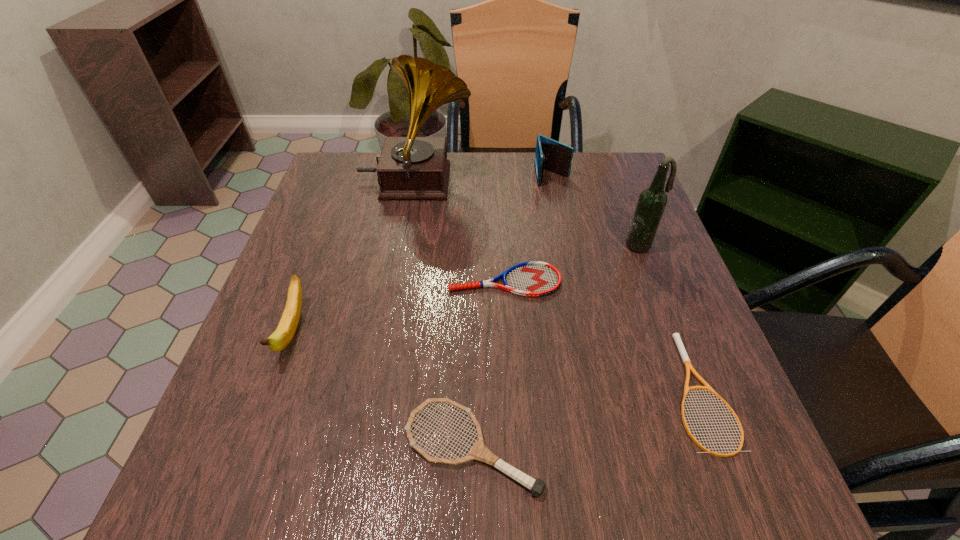
The height and width of the screenshot is (540, 960). I want to click on tennis racket that is the nearest to the sixth shortest object, so (533, 278).

You are a GUI agent. You are given a task and a screenshot of the screen. Output one action in this format:
    pyautogui.click(x=<x>, y=<y>)
    Task: Click on the free space that satisfies the following two spatial constraints: 1. from the horn of the tallest object; 2. on the right side of the farthest tennis racket
    This screenshot has height=540, width=960.
    Given the screenshot: What is the action you would take?
    pyautogui.click(x=398, y=281)

Find the location of a particular element. free space that satisfies the following two spatial constraints: 1. from the horn of the phonograph record; 2. on the back side of the beer bottle is located at coordinates (404, 246).

This screenshot has height=540, width=960. I want to click on free space that satisfies the following two spatial constraints: 1. on the exterior surface of the wallet; 2. from the horn of the phonograph record, so click(554, 183).

The height and width of the screenshot is (540, 960). What are the coordinates of `vacant area in the image that satisfies the following two spatial constraints: 1. at the stem of the third shortest object; 2. on the right side of the leftmost object` in the screenshot? It's located at 251,448.

At what (x,y) coordinates should I click in order to perform the action: click on free space that satisfies the following two spatial constraints: 1. from the horn of the phonograph record; 2. on the left side of the farthest tennis racket. Please return your answer as a coordinate pair (x, y). Looking at the image, I should click on (398, 281).

Where is `vacant space that satisfies the following two spatial constraints: 1. from the horn of the tallest tennis racket; 2. on the right side of the phonograph record`? vacant space that satisfies the following two spatial constraints: 1. from the horn of the tallest tennis racket; 2. on the right side of the phonograph record is located at coordinates (369, 448).

Locate an element on the screen. free space that satisfies the following two spatial constraints: 1. on the front side of the fifth nearest object; 2. on the left side of the shortest tennis racket is located at coordinates (696, 391).